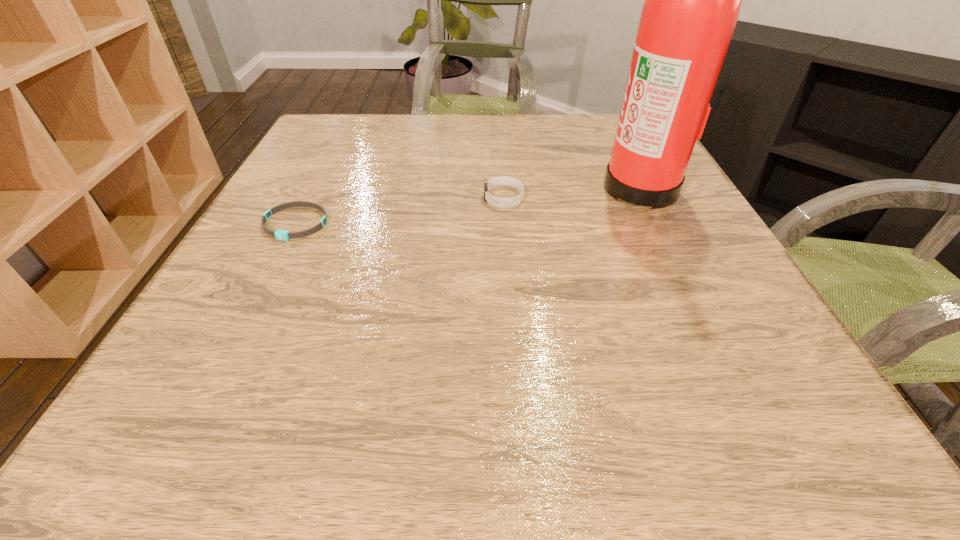
Locate an element on the screen. empty location between the second tallest object and the left wristband is located at coordinates (399, 211).

Locate an element on the screen. This screenshot has height=540, width=960. free space that is in between the shorter wristband and the fire extinguisher is located at coordinates (468, 205).

Locate an element on the screen. The image size is (960, 540). free point between the fire extinguisher and the second shortest object is located at coordinates (572, 192).

Locate an element on the screen. free space between the left wristband and the second object from left to right is located at coordinates (399, 211).

Locate an element on the screen. free space that is in between the tallest object and the left wristband is located at coordinates (468, 205).

You are a GUI agent. You are given a task and a screenshot of the screen. Output one action in this format:
    pyautogui.click(x=<x>, y=<y>)
    Task: Click on the vacant region between the shortest object and the second tallest object
    The width and height of the screenshot is (960, 540).
    Given the screenshot: What is the action you would take?
    pyautogui.click(x=399, y=211)

This screenshot has height=540, width=960. What are the coordinates of `empty location between the leftmost object and the right wristband` in the screenshot? It's located at (399, 211).

The image size is (960, 540). In order to click on empty location between the rightmost object and the taller wristband in this screenshot , I will do `click(572, 192)`.

Locate an element on the screen. object that is the closest one to the shorter wristband is located at coordinates (501, 180).

Where is `object that stands as the closest to the tallest object`? object that stands as the closest to the tallest object is located at coordinates (501, 180).